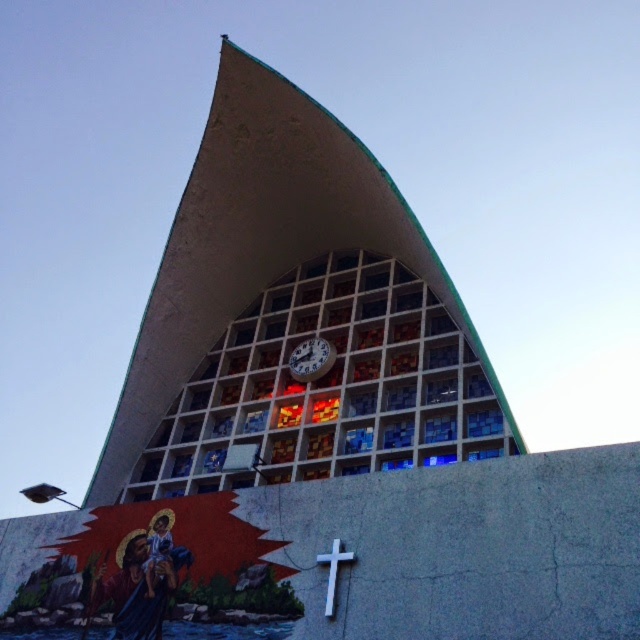
Who is positioned more to the right, stained glass at center or white matte cross at center?

Positioned to the right is white matte cross at center.

Is stained glass at center bigger than white matte cross at center?

Indeed, stained glass at center has a larger size compared to white matte cross at center.

Based on the photo, who is more forward, (432, 456) or (342, 556)?

Point (342, 556) is more forward.

Where is `stained glass at center`? stained glass at center is located at coordinates (328, 387).

Can you confirm if metallic clock at center is shorter than white matte cross at center?

Incorrect, metallic clock at center's height does not fall short of white matte cross at center's.

Who is more forward, (310, 368) or (336, 560)?

Point (336, 560) is in front.

Identify the location of metallic clock at center. (310, 358).

Can you confirm if stained glass at center is taller than metallic clock at center?

Yes, stained glass at center is taller than metallic clock at center.

Does stained glass at center lie in front of metallic clock at center?

Yes.

Which is in front, point (456, 390) or point (291, 358)?

Positioned in front is point (456, 390).

The image size is (640, 640). In order to click on stained glass at center in this screenshot , I will do `click(328, 387)`.